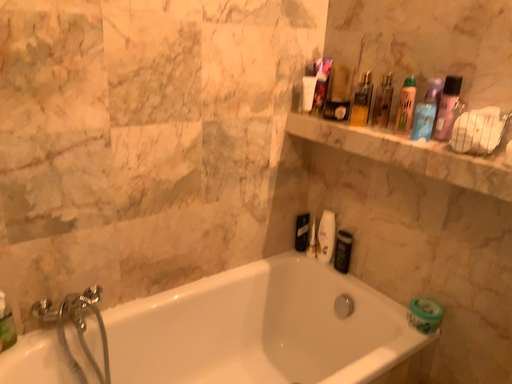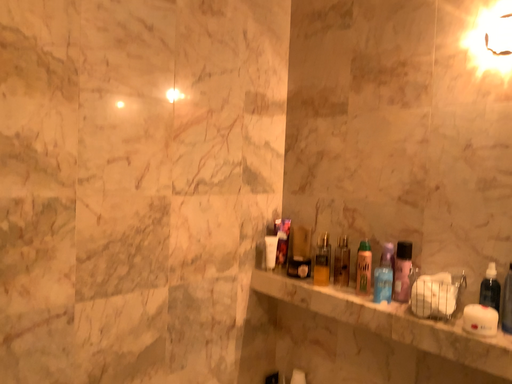
Question: Which way did the camera rotate in the video?

Choices:
 (A) rotated upward
 (B) rotated downward

Answer: (A)